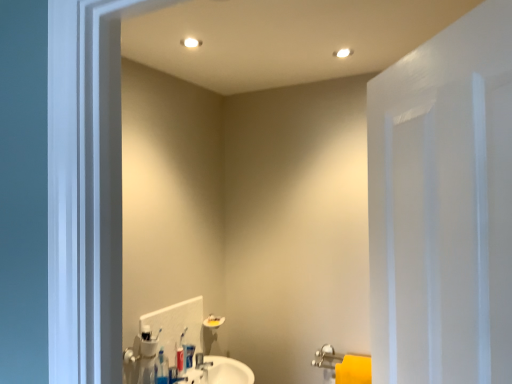
Question: Would you consider matte plastic toothpaste tube at center to be distant from white painted wood door at right?

Choices:
 (A) yes
 (B) no

Answer: (A)

Question: Are matte plastic toothpaste tube at center and white painted wood door at right making contact?

Choices:
 (A) yes
 (B) no

Answer: (B)

Question: From a real-world perspective, is matte plastic toothpaste tube at center on white painted wood door at right?

Choices:
 (A) no
 (B) yes

Answer: (A)

Question: Can you confirm if matte plastic toothpaste tube at center is thinner than white painted wood door at right?

Choices:
 (A) no
 (B) yes

Answer: (B)

Question: Is matte plastic toothpaste tube at center not within white painted wood door at right?

Choices:
 (A) yes
 (B) no

Answer: (A)

Question: Looking at their shapes, would you say matte plastic toothpaste tube at center is wider or thinner than white plastic toothbrush at center?

Choices:
 (A) wide
 (B) thin

Answer: (B)

Question: Considering the positions of matte plastic toothpaste tube at center and white plastic toothbrush at center in the image, is matte plastic toothpaste tube at center taller or shorter than white plastic toothbrush at center?

Choices:
 (A) short
 (B) tall

Answer: (A)

Question: In the image, is matte plastic toothpaste tube at center positioned in front of or behind white plastic toothbrush at center?

Choices:
 (A) behind
 (B) front

Answer: (A)

Question: From a real-world perspective, is matte plastic toothpaste tube at center positioned above or below white plastic toothbrush at center?

Choices:
 (A) below
 (B) above

Answer: (A)

Question: Is white painted wood door at right taller or shorter than matte silver faucet at center?

Choices:
 (A) tall
 (B) short

Answer: (A)

Question: Is white painted wood door at right wider or thinner than matte silver faucet at center?

Choices:
 (A) thin
 (B) wide

Answer: (B)

Question: Do you think white painted wood door at right is within matte silver faucet at center, or outside of it?

Choices:
 (A) inside
 (B) outside

Answer: (B)

Question: From the image's perspective, is white painted wood door at right above or below matte silver faucet at center?

Choices:
 (A) below
 (B) above

Answer: (B)

Question: Is white painted wood door at right spatially inside white plastic toothbrush at center, or outside of it?

Choices:
 (A) inside
 (B) outside

Answer: (B)

Question: In terms of size, does white painted wood door at right appear bigger or smaller than white plastic toothbrush at center?

Choices:
 (A) small
 (B) big

Answer: (B)